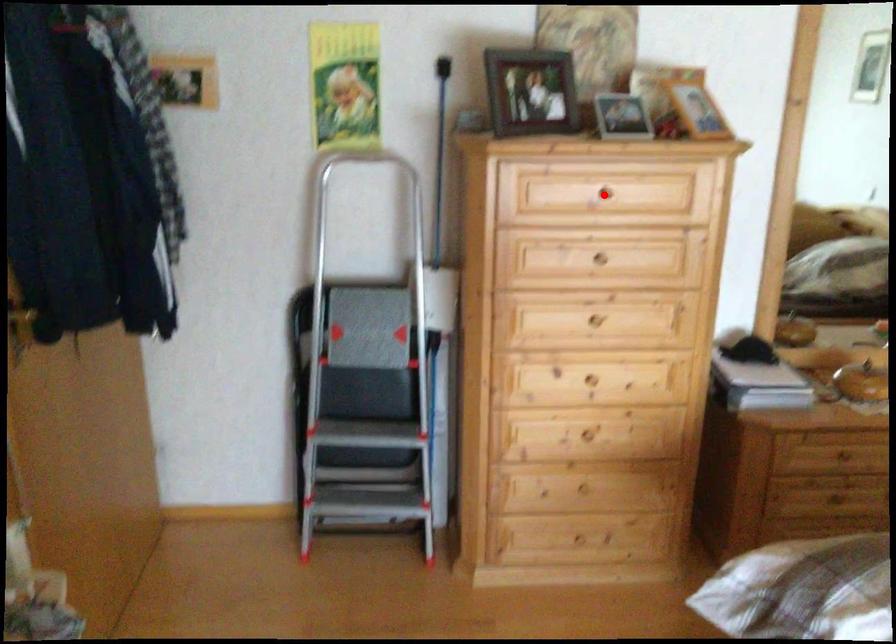
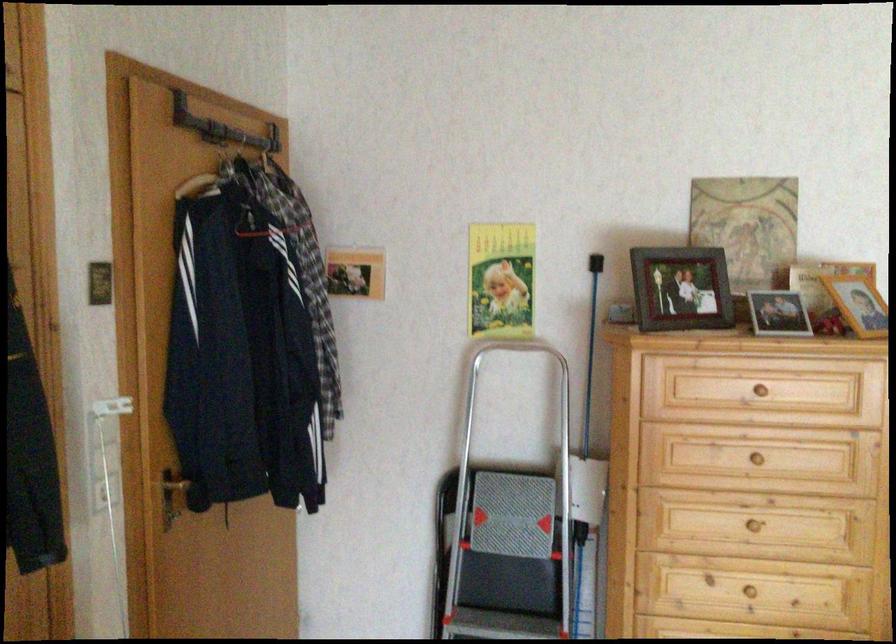
The point at the highlighted location is marked in the first image. Where is the corresponding point in the second image?

(763, 391)